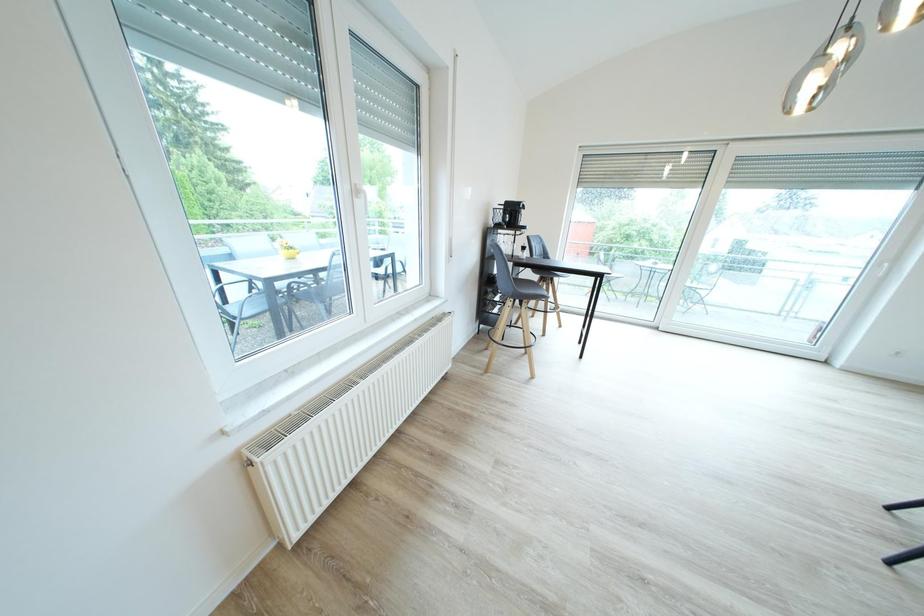
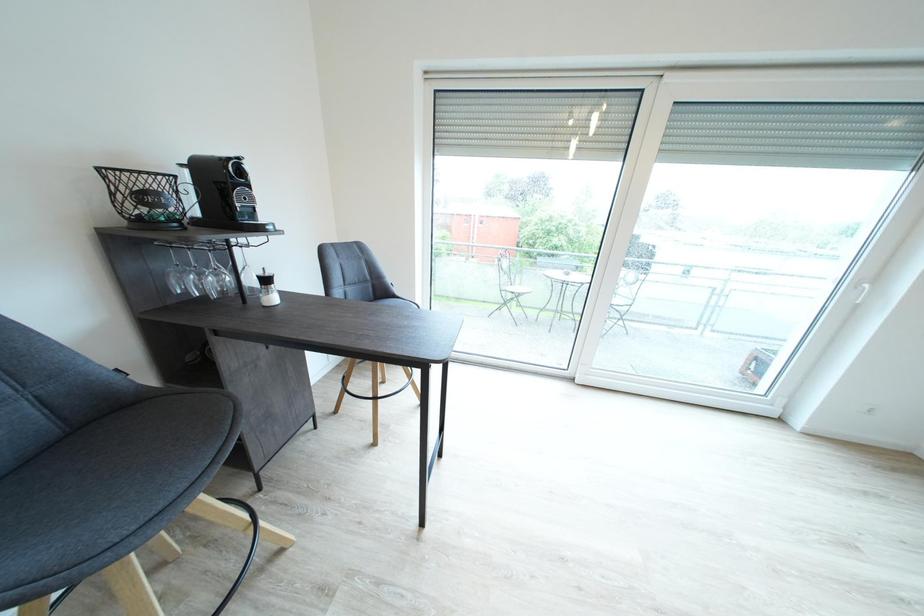
Which direction would the cameraman need to move to produce the second image?

The movement direction of the cameraman is right, forward.